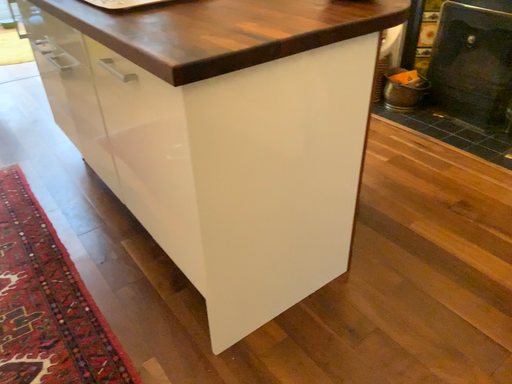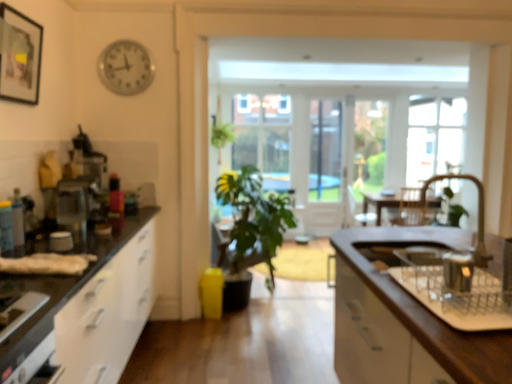
Question: How did the camera likely rotate when shooting the video?

Choices:
 (A) rotated right
 (B) rotated left

Answer: (B)